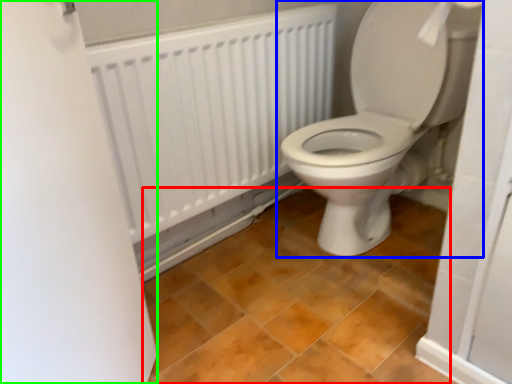
Question: Based on their relative distances, which object is farther from ceramic tile (highlighted by a red box)? Choose from toilet (highlighted by a blue box) and screen door (highlighted by a green box).

Choices:
 (A) toilet
 (B) screen door

Answer: (B)